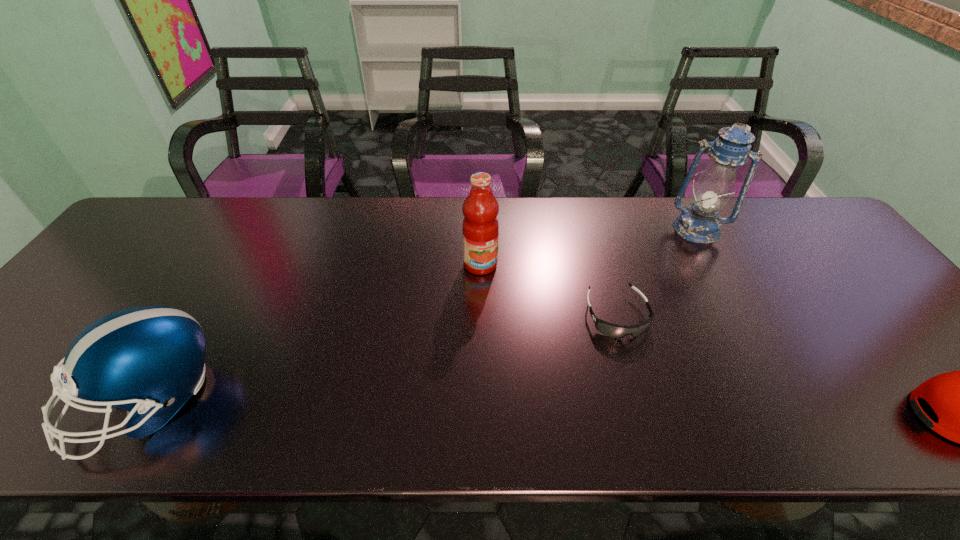
Locate an element on the screen. free space at the right edge is located at coordinates (815, 264).

In the image, there is a desktop. At what (x,y) coordinates should I click in order to perform the action: click on vacant space at the far right corner. Please return your answer as a coordinate pair (x, y). Looking at the image, I should click on 779,202.

This screenshot has height=540, width=960. I want to click on vacant space that's between the third object from left to right and the second farthest object, so click(x=548, y=290).

You are a GUI agent. You are given a task and a screenshot of the screen. Output one action in this format:
    pyautogui.click(x=<x>, y=<y>)
    Task: Click on the free spot between the fourth object from right to left and the leftmost object
    
    Given the screenshot: What is the action you would take?
    pyautogui.click(x=315, y=333)

Image resolution: width=960 pixels, height=540 pixels. I want to click on free space that is in between the farthest object and the leftmost object, so click(423, 315).

Locate an element on the screen. free point between the football helmet and the second tallest object is located at coordinates (315, 333).

The height and width of the screenshot is (540, 960). Find the location of `empty space between the goggles and the lantern`. empty space between the goggles and the lantern is located at coordinates (657, 272).

Identify the location of vacant space in between the lantern and the shortest object. (657, 272).

Image resolution: width=960 pixels, height=540 pixels. Identify the location of object that is the third nearest to the third object from right to left. (959, 398).

Locate an element on the screen. This screenshot has height=540, width=960. object that ranks as the second closest to the football helmet is located at coordinates (615, 331).